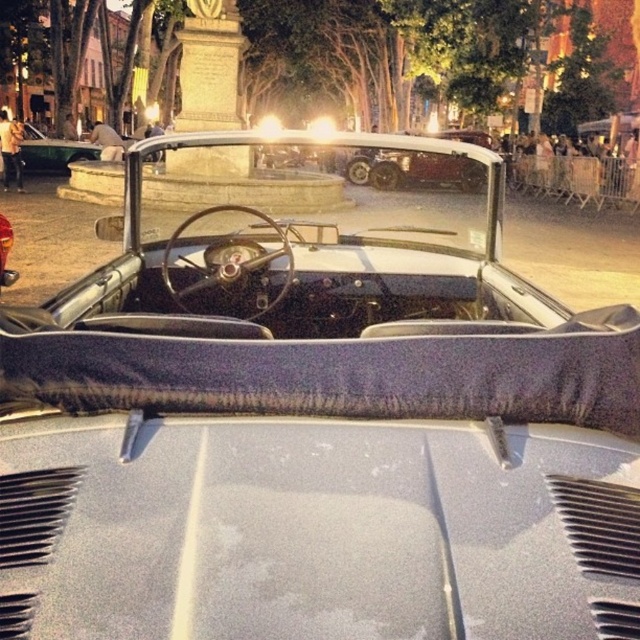
You are a photographer trying to capture the clear glass windshield at center from a specific angle. If you position yourself directly in front of the car, where would you aim your camera to ensure the windshield is centered in your shot?

To center the clear glass windshield at center in your shot, aim your camera at the coordinates point (x=316, y=177), as that is the 2D location of the clear glass windshield at center.

You are a photographer standing at the center of the scene, aiming to capture a photo that includes both the clear glass windshield at center and the matte black convertible at left. Given that your camera has a maximum focus range of 30 feet, will you be able to focus on both objects simultaneously?

The clear glass windshield at center and the matte black convertible at left are 30.19 feet apart from each other. Since the distance between them exceeds the camera maximum focus range of 30 feet, you will not be able to focus on both objects simultaneously.

You are a photographer at the car show and want to capture the matte black convertible at left through the clear glass windshield at center. Can you do this? Please explain why or why not based on their positions.

The clear glass windshield at center is to the right of the matte black convertible at left. Since the windshield is positioned to the right of the convertible, the photographer cannot capture the convertible through the windshield as they are not aligned in a way that allows the windshield to frame the convertible.